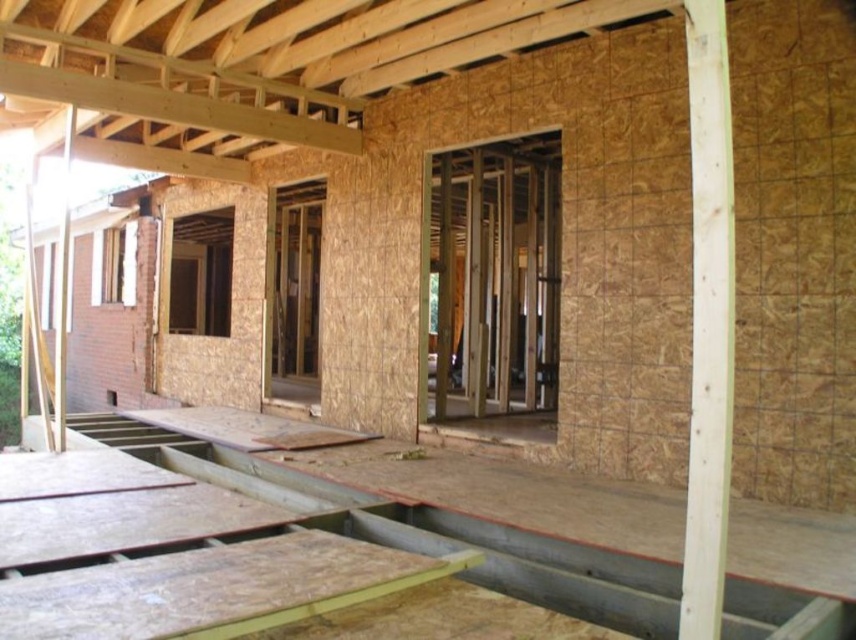
Which is above, wooden floorboards at center or light brown wood at right?

light brown wood at right is higher up.

Describe the element at coordinates (262, 547) in the screenshot. I see `wooden floorboards at center` at that location.

Is point (6, 474) behind point (693, 58)?

Yes.

Identify the location of wooden floorboards at center. The height and width of the screenshot is (640, 856). (262, 547).